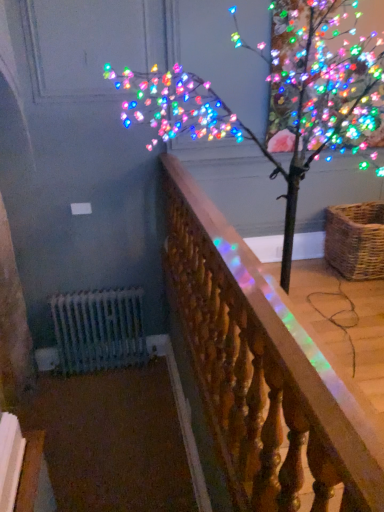
Question: Should I look upward or downward to see iridescent wood railing at center?

Choices:
 (A) down
 (B) up

Answer: (A)

Question: From a real-world perspective, does woven brown basket at right sit lower than iridescent wood railing at center?

Choices:
 (A) yes
 (B) no

Answer: (A)

Question: Is woven brown basket at right aimed at iridescent wood railing at center?

Choices:
 (A) no
 (B) yes

Answer: (A)

Question: Is woven brown basket at right closer to the viewer compared to iridescent wood railing at center?

Choices:
 (A) yes
 (B) no

Answer: (B)

Question: Can you confirm if woven brown basket at right is taller than iridescent wood railing at center?

Choices:
 (A) yes
 (B) no

Answer: (B)

Question: Is woven brown basket at right located outside iridescent wood railing at center?

Choices:
 (A) yes
 (B) no

Answer: (A)

Question: Does woven brown basket at right have a lesser height compared to iridescent wood railing at center?

Choices:
 (A) yes
 (B) no

Answer: (A)

Question: Considering the relative positions of iridescent wood railing at center and woven brown basket at right in the image provided, is iridescent wood railing at center behind woven brown basket at right?

Choices:
 (A) yes
 (B) no

Answer: (B)

Question: Is iridescent wood railing at center not within woven brown basket at right?

Choices:
 (A) yes
 (B) no

Answer: (A)

Question: Does iridescent wood railing at center lie in front of woven brown basket at right?

Choices:
 (A) yes
 (B) no

Answer: (A)

Question: Can you confirm if iridescent wood railing at center is positioned to the right of woven brown basket at right?

Choices:
 (A) no
 (B) yes

Answer: (A)

Question: Does iridescent wood railing at center have a lesser height compared to woven brown basket at right?

Choices:
 (A) no
 (B) yes

Answer: (A)

Question: Considering the relative sizes of iridescent wood railing at center and woven brown basket at right in the image provided, is iridescent wood railing at center bigger than woven brown basket at right?

Choices:
 (A) yes
 (B) no

Answer: (A)

Question: From their relative heights in the image, would you say iridescent wood railing at center is taller or shorter than woven brown basket at right?

Choices:
 (A) short
 (B) tall

Answer: (B)